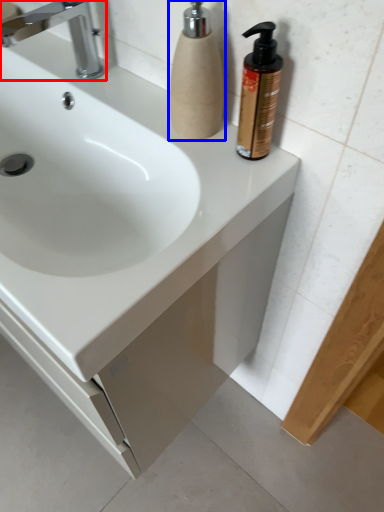
Question: Which of the following is the farthest to the observer, tap (highlighted by a red box) or soap dispenser (highlighted by a blue box)?

Choices:
 (A) tap
 (B) soap dispenser

Answer: (A)